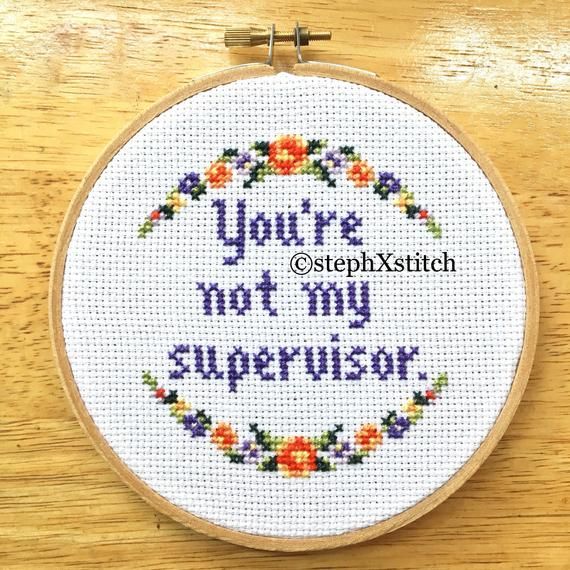
Find the location of `orange flowers`. orange flowers is located at coordinates (226, 435), (295, 453), (369, 439), (430, 394), (157, 392), (157, 214), (219, 179), (283, 150), (355, 171), (420, 219).